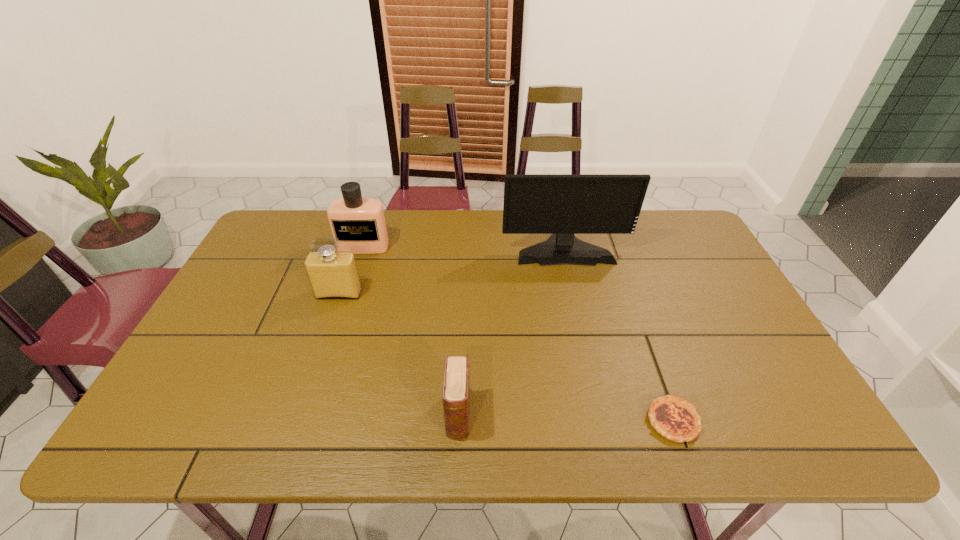
Identify the location of monitor. The image size is (960, 540). (562, 205).

The width and height of the screenshot is (960, 540). I want to click on the farther perfume, so click(x=359, y=223).

The height and width of the screenshot is (540, 960). I want to click on the third nearest object, so 332,274.

The width and height of the screenshot is (960, 540). I want to click on the shorter perfume, so click(332, 274).

Find the location of a particular element. The height and width of the screenshot is (540, 960). the third object from right to left is located at coordinates (456, 386).

Locate an element on the screen. The height and width of the screenshot is (540, 960). diary is located at coordinates (456, 386).

At what (x,y) coordinates should I click in order to perform the action: click on quiche. Please return your answer as a coordinate pair (x, y). Looking at the image, I should click on (674, 418).

Locate an element on the screen. free space located on the screen side of the tallest object is located at coordinates (579, 314).

The width and height of the screenshot is (960, 540). I want to click on free space located 0.190m on the front label of the farther perfume, so click(x=348, y=297).

The image size is (960, 540). Identify the location of blank area located on the front-facing side of the third shortest object. (321, 348).